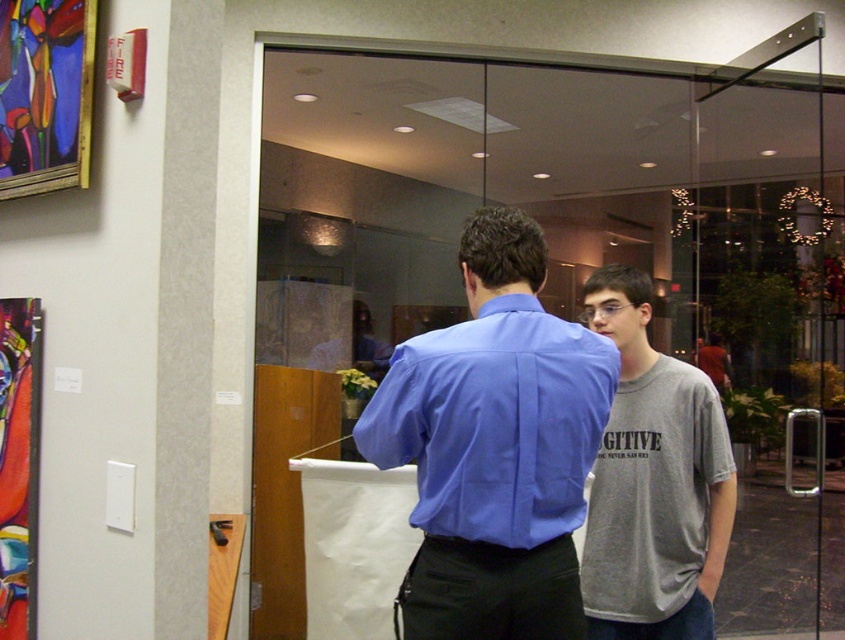
Can you confirm if matte blue dress shirt at center is shorter than abstract painting at left?

Yes.

Looking at this image, between matte blue dress shirt at center and abstract painting at left, which one appears on the left side from the viewer's perspective?

From the viewer's perspective, abstract painting at left appears more on the left side.

Locate an element on the screen. The height and width of the screenshot is (640, 845). matte blue dress shirt at center is located at coordinates (494, 422).

You are a GUI agent. You are given a task and a screenshot of the screen. Output one action in this format:
    pyautogui.click(x=<x>, y=<y>)
    Task: Click on the matte blue dress shirt at center
    The width and height of the screenshot is (845, 640).
    Given the screenshot: What is the action you would take?
    pyautogui.click(x=494, y=422)

Which is above, matte blue dress shirt at center or gray cotton t-shirt at center?

matte blue dress shirt at center is above.

Is point (543, 493) less distant than point (669, 472)?

Yes, point (543, 493) is in front of point (669, 472).

Is point (514, 436) closer to viewer compared to point (704, 515)?

Yes, point (514, 436) is closer to viewer.

Locate an element on the screen. matte blue dress shirt at center is located at coordinates (494, 422).

Does gray cotton t-shirt at center appear on the right side of abstract painting at left?

Yes, gray cotton t-shirt at center is to the right of abstract painting at left.

Which is in front, point (636, 456) or point (20, 595)?

Point (20, 595)

Is point (617, 394) farther from camera compared to point (3, 595)?

Yes.

Locate an element on the screen. Image resolution: width=845 pixels, height=640 pixels. gray cotton t-shirt at center is located at coordinates (653, 481).